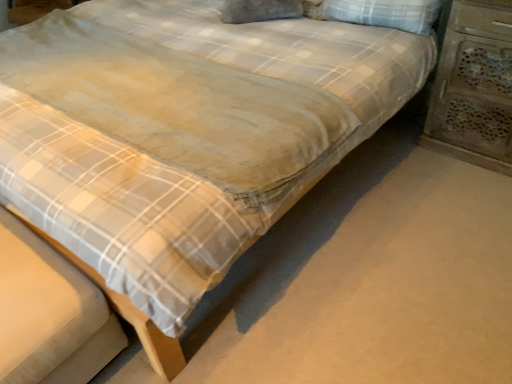
This screenshot has height=384, width=512. Identify the location of free space in front of wooden carved nightstand at right. (470, 193).